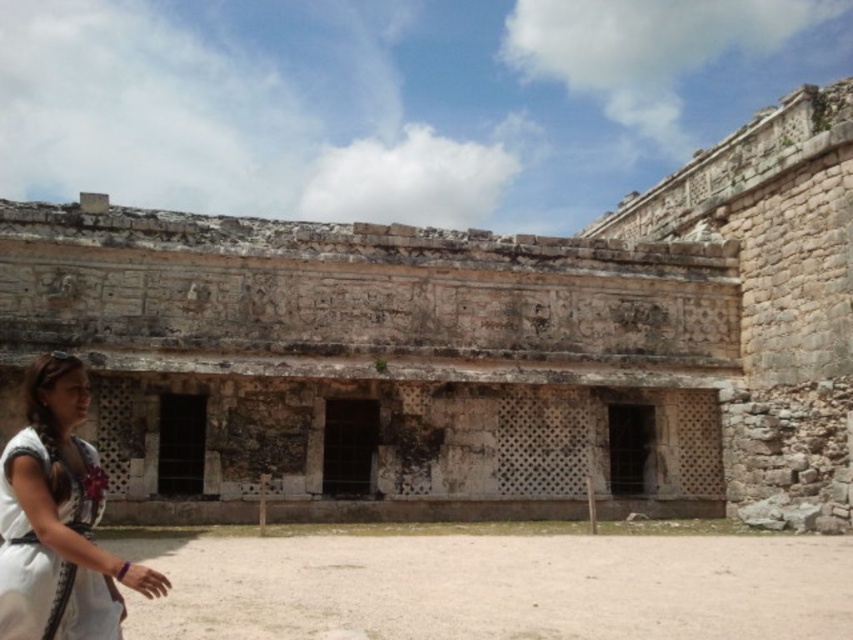
Question: Is the position of weathered stone ruins at center more distant than that of white fabric dress at lower left?

Choices:
 (A) no
 (B) yes

Answer: (B)

Question: Which object is farther from the camera taking this photo?

Choices:
 (A) white fabric dress at lower left
 (B) weathered stone ruins at center

Answer: (B)

Question: Among these objects, which one is nearest to the camera?

Choices:
 (A) white fabric dress at lower left
 (B) weathered stone ruins at center

Answer: (A)

Question: Where is weathered stone ruins at center located in relation to white fabric dress at lower left in the image?

Choices:
 (A) left
 (B) right

Answer: (B)

Question: Does weathered stone ruins at center appear on the right side of white fabric dress at lower left?

Choices:
 (A) yes
 (B) no

Answer: (A)